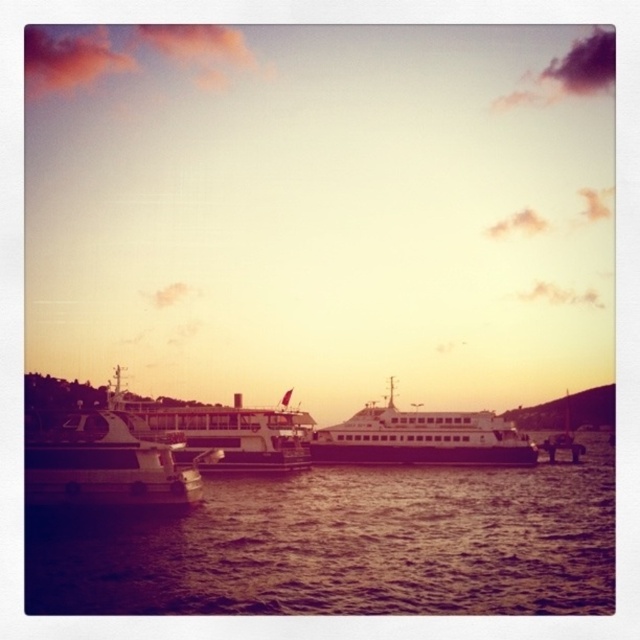
Question: Based on their relative distances, which object is nearer to the brown water at center?

Choices:
 (A) metallic white ferry at center
 (B) white glossy ferry at left

Answer: (B)

Question: Observing the image, what is the correct spatial positioning of white matte boat at center in reference to metallic white ferry at center?

Choices:
 (A) below
 (B) above

Answer: (A)

Question: Can you confirm if white glossy ferry at left is positioned below metallic white ferry at center?

Choices:
 (A) yes
 (B) no

Answer: (A)

Question: Does white glossy ferry at left have a lesser width compared to white matte boat at center?

Choices:
 (A) no
 (B) yes

Answer: (B)

Question: Which is farther from the white glossy ferry at left?

Choices:
 (A) metallic white ferry at center
 (B) brown water at center
 (C) white matte boat at center

Answer: (C)

Question: Considering the real-world distances, which object is farthest from the metallic white ferry at center?

Choices:
 (A) white matte boat at center
 (B) white glossy ferry at left

Answer: (A)